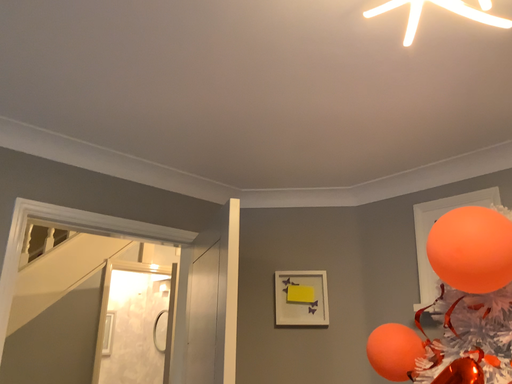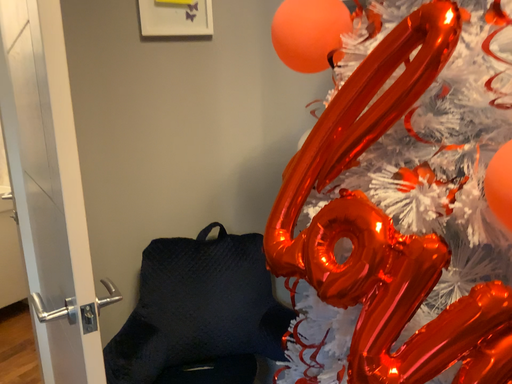
Question: Which way did the camera rotate in the video?

Choices:
 (A) rotated upward
 (B) rotated downward

Answer: (B)